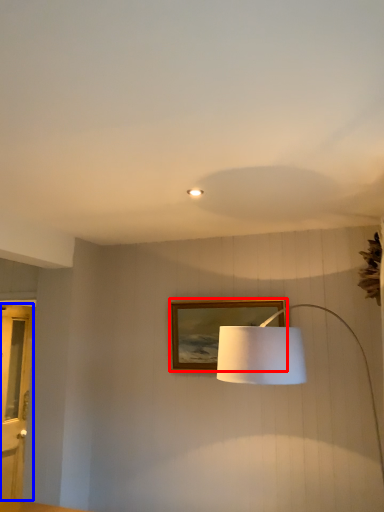
Question: Which object appears farthest to the camera in this image, picture frame (highlighted by a red box) or glass door (highlighted by a blue box)?

Choices:
 (A) picture frame
 (B) glass door

Answer: (B)